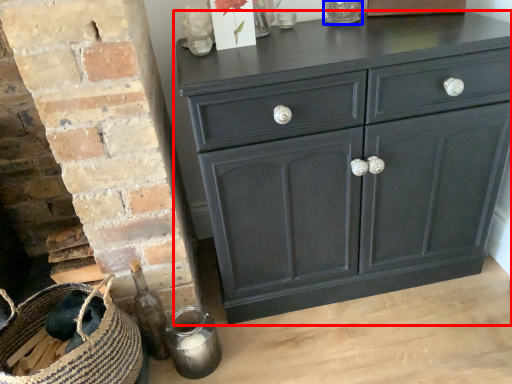
Question: Which object is further to the camera taking this photo, chest of drawers (highlighted by a red box) or glass vase (highlighted by a blue box)?

Choices:
 (A) chest of drawers
 (B) glass vase

Answer: (B)